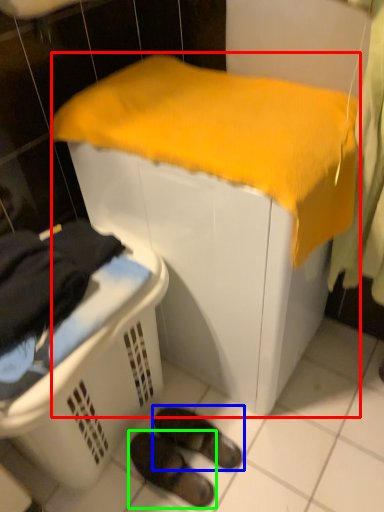
Question: Estimate the real-world distances between objects in this image. Which object is closer to furniture (highlighted by a red box), footwear (highlighted by a blue box) or footwear (highlighted by a green box)?

Choices:
 (A) footwear
 (B) footwear

Answer: (A)